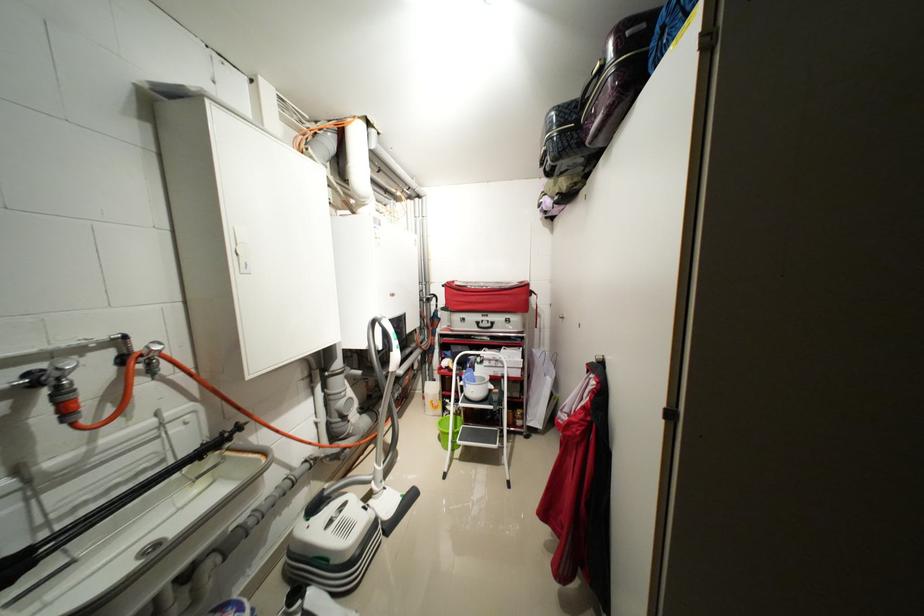
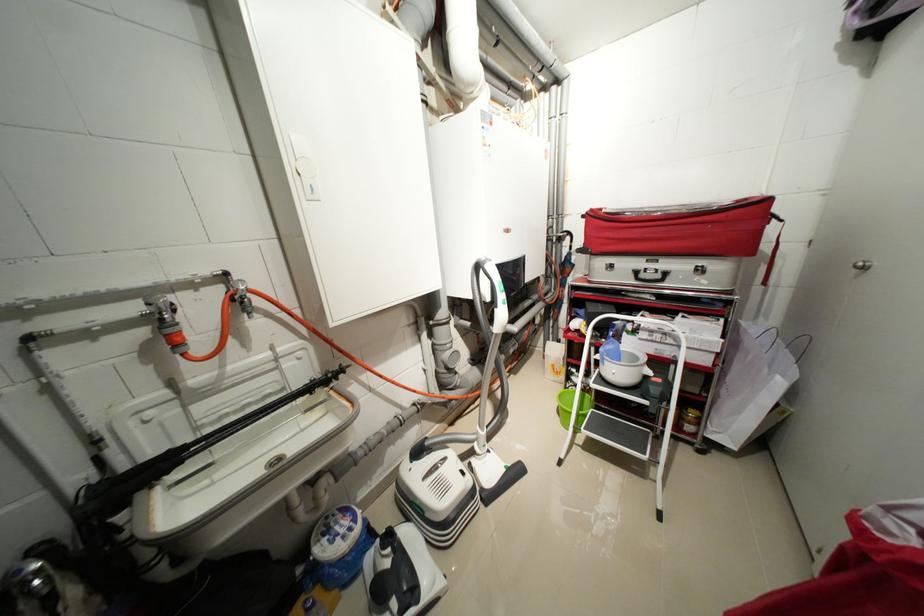
Question: I am providing you with two images of the same scene from different viewpoints. After the viewpoint changes to image2, which objects are now occluded?

Choices:
 (A) black ladder step
 (B) black suitcase handle
 (C) green bucket
 (D) none of these

Answer: (D)